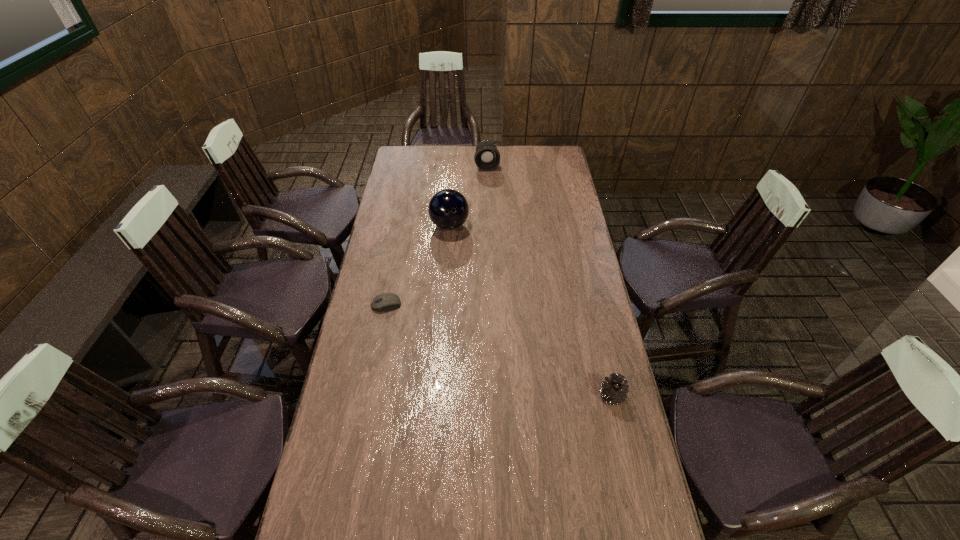
Find the location of a particular element. This screenshot has width=960, height=540. the shortest object is located at coordinates (383, 302).

Locate an element on the screen. This screenshot has height=540, width=960. the leftmost object is located at coordinates (383, 302).

Find the location of a particular element. The image size is (960, 540). pinecone is located at coordinates (614, 391).

This screenshot has height=540, width=960. I want to click on the second shortest object, so click(614, 391).

Identify the location of the third object from left to right. Image resolution: width=960 pixels, height=540 pixels. (487, 157).

In order to click on the farthest object in this screenshot , I will do `click(487, 157)`.

Find the location of a particular element. The height and width of the screenshot is (540, 960). bowling ball is located at coordinates (448, 209).

Image resolution: width=960 pixels, height=540 pixels. Find the location of `the second object from left to right`. the second object from left to right is located at coordinates (448, 209).

Image resolution: width=960 pixels, height=540 pixels. Find the location of `vacant area situated 0.100m on the back of the computer equipment`. vacant area situated 0.100m on the back of the computer equipment is located at coordinates (392, 279).

I want to click on vacant region located 0.200m on the back of the pinecone, so click(598, 335).